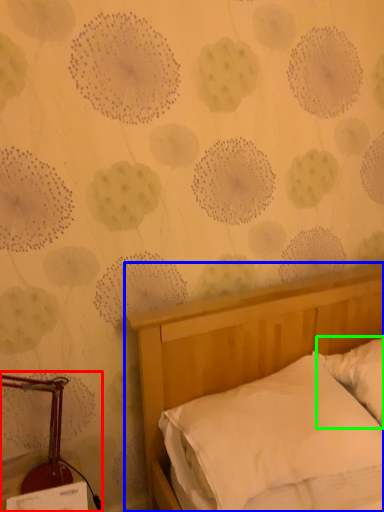
Question: Which object is the farthest from bedside lamp (highlighted by a red box)? Choose among these: bed (highlighted by a blue box) or pillow (highlighted by a green box).

Choices:
 (A) bed
 (B) pillow

Answer: (B)